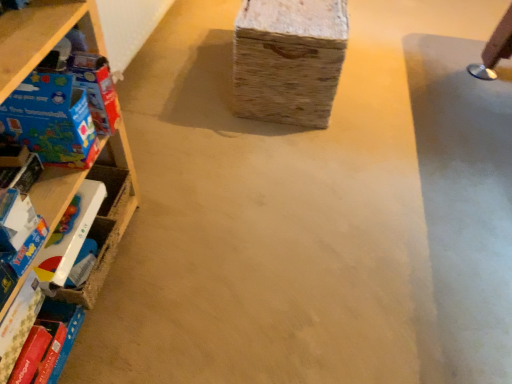
Question: From a real-world perspective, is matte plastic toy at left, positioned as the third toy in top-to-bottom order, on matte plastic toy at left, the first toy positioned from the bottom?

Choices:
 (A) no
 (B) yes

Answer: (B)

Question: Is matte plastic toy at left, positioned as the third toy in top-to-bottom order, far away from matte plastic toy at left, the first toy positioned from the bottom?

Choices:
 (A) yes
 (B) no

Answer: (B)

Question: Is matte plastic toy at left, positioned as the third toy in top-to-bottom order, oriented away from matte plastic toy at left, the first toy positioned from the bottom?

Choices:
 (A) no
 (B) yes

Answer: (A)

Question: Is matte plastic toy at left, the first toy positioned from the bottom, inside matte plastic toy at left, positioned as the third toy in top-to-bottom order?

Choices:
 (A) no
 (B) yes

Answer: (A)

Question: Is matte plastic toy at left, marked as the 2th toy in a bottom-to-top arrangement, to the right of matte plastic toy at left, which ranks as the 4th toy in top-to-bottom order, from the viewer's perspective?

Choices:
 (A) no
 (B) yes

Answer: (A)

Question: Choose the correct answer: Is matte cardboard box at left, the second toy when ordered from top to bottom, inside blue cardboard box at left, the first toy when ordered from top to bottom, or outside it?

Choices:
 (A) outside
 (B) inside

Answer: (A)

Question: From a real-world perspective, is matte cardboard box at left, the second toy when ordered from top to bottom, positioned above or below blue cardboard box at left, the 4th toy in the bottom-to-top sequence?

Choices:
 (A) below
 (B) above

Answer: (A)

Question: Considering the positions of point (83, 157) and point (57, 61), is point (83, 157) closer or farther from the camera than point (57, 61)?

Choices:
 (A) farther
 (B) closer

Answer: (A)

Question: Relative to blue cardboard box at left, the first toy when ordered from top to bottom, is matte cardboard box at left, which ranks as the 3th toy in bottom-to-top order, in front or behind?

Choices:
 (A) behind
 (B) front

Answer: (B)

Question: From a real-world perspective, is matte plastic toy at left, marked as the 2th toy in a bottom-to-top arrangement, above or below hardcover book at lower left?

Choices:
 (A) below
 (B) above

Answer: (B)

Question: Based on their sizes in the image, would you say matte plastic toy at left, marked as the 2th toy in a bottom-to-top arrangement, is bigger or smaller than hardcover book at lower left?

Choices:
 (A) big
 (B) small

Answer: (B)

Question: In terms of width, does matte plastic toy at left, marked as the 2th toy in a bottom-to-top arrangement, look wider or thinner when compared to hardcover book at lower left?

Choices:
 (A) wide
 (B) thin

Answer: (A)

Question: In the image, is matte plastic toy at left, positioned as the third toy in top-to-bottom order, positioned in front of or behind hardcover book at lower left?

Choices:
 (A) behind
 (B) front

Answer: (B)

Question: From a real-world perspective, relative to matte plastic toy at left, marked as the 2th toy in a bottom-to-top arrangement, is matte plastic toy at left, the first toy positioned from the bottom, vertically above or below?

Choices:
 (A) above
 (B) below

Answer: (B)

Question: In terms of width, does matte plastic toy at left, which ranks as the 4th toy in top-to-bottom order, look wider or thinner when compared to matte plastic toy at left, positioned as the third toy in top-to-bottom order?

Choices:
 (A) thin
 (B) wide

Answer: (A)